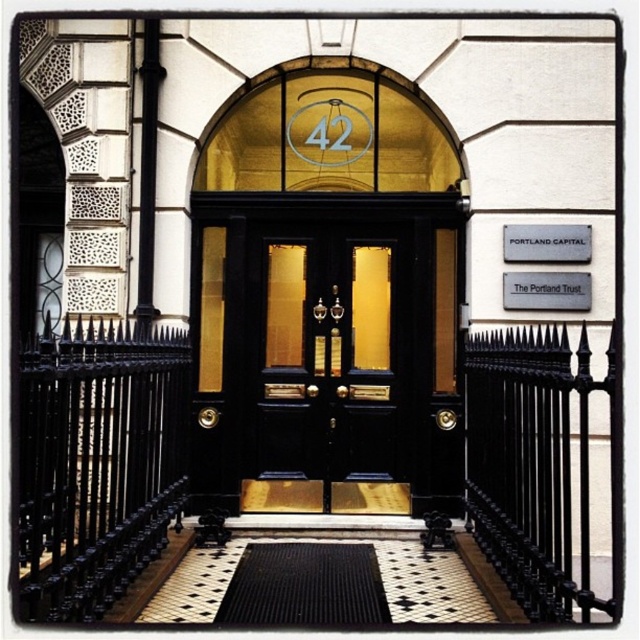
Who is lower down, black polished wood door at center or black rubber doormat at center?

black rubber doormat at center

How far apart are black polished wood door at center and black rubber doormat at center?

black polished wood door at center is 1.34 meters from black rubber doormat at center.

Find the location of `black polished wood door at center`. black polished wood door at center is located at coordinates (326, 358).

Can you confirm if matte black door at center is bigger than black polished wood door at center?

Yes.

Is point (243, 340) in front of point (268, 250)?

Yes, point (243, 340) is closer to viewer.

At what (x,y) coordinates should I click in order to perform the action: click on matte black door at center. Please return your answer as a coordinate pair (x, y). Looking at the image, I should click on (326, 346).

Is black polished wood door at center below metallic gray sign at upper right?

Yes.

Does black polished wood door at center have a greater width compared to metallic gray sign at upper right?

Yes.

Who is more forward, (328, 355) or (586, 260)?

Point (586, 260)

Where is `black polished wood door at center`? black polished wood door at center is located at coordinates (326, 358).